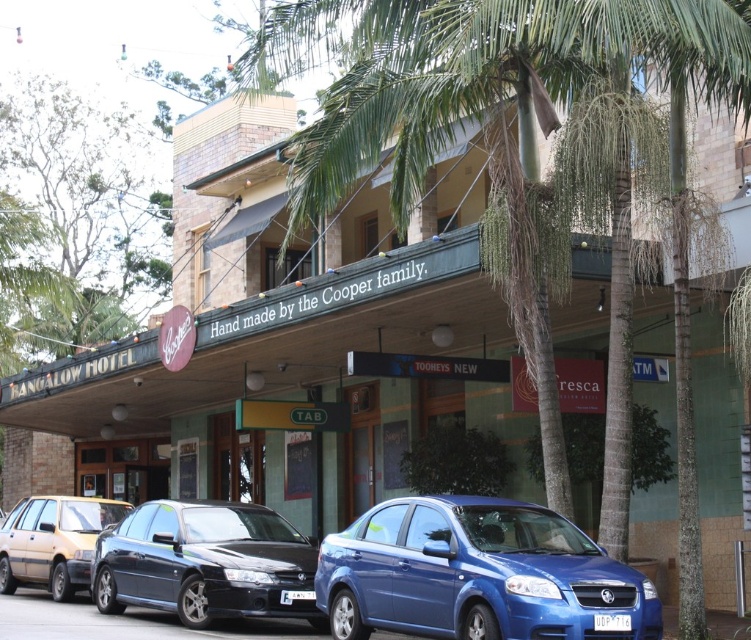
You are a delivery driver who needs to park your van, which is 2 meters wide, in the street. You see the shiny black sedan at center and the white plastic license plate at center. Can you determine if your van will fit between them?

The shiny black sedan at center is wider than the white plastic license plate at center, so the space between them may not be sufficient for a van that is 2 meters wide. You should check the exact distance before deciding.

You are standing at the entrance of the BANGALOW HOTEL and want to take a photo of the green leafy palm tree at center. Where should you position yourself to capture it in the frame?

The green leafy palm tree at center is located at coordinates 0.225 on the x axis and 0.668 on the y axis, so position yourself facing the center area slightly to the left and lower down to capture it in the frame.

You are a delivery person who needs to park your 2.5 meter wide truck between the green leafy palm tree at center and the matte beige sedan at lower left. Can you fit your truck without overlapping either vehicle?

The distance between the green leafy palm tree at center and the matte beige sedan at lower left is 8.87 meters. Since the truck is 2.5 meters wide, there is sufficient space to park it between them without overlapping either vehicle.